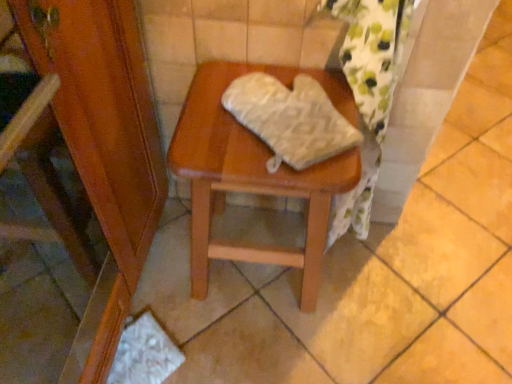
The width and height of the screenshot is (512, 384). In order to click on vacant space in front of wooden stool at center in this screenshot , I will do `click(268, 349)`.